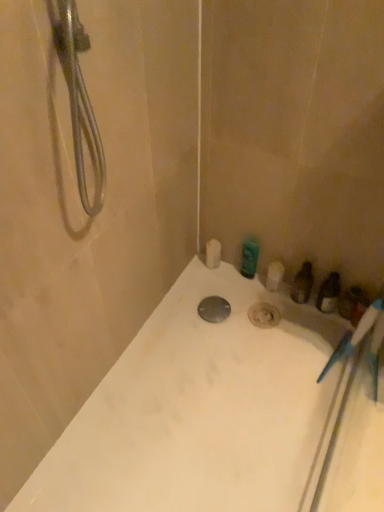
The height and width of the screenshot is (512, 384). I want to click on free spot in front of metallic silver drain at center, so click(216, 352).